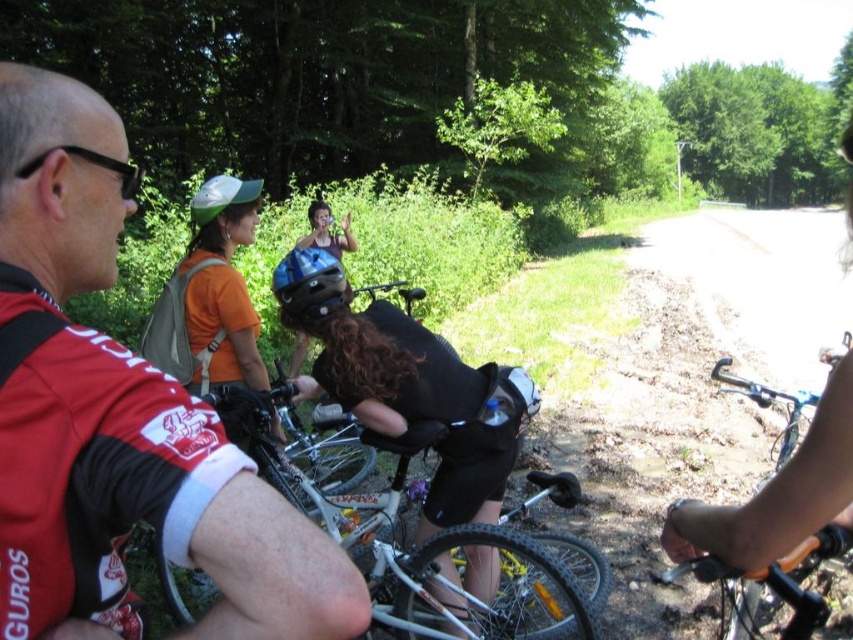
You are a photographer trying to capture a clear shot of the red jersey at center and the matte black helmet at center. Since you want to focus on the smaller object, which one should you aim your camera at?

The red jersey at center has a smaller size compared to matte black helmet at center, so you should aim your camera at the red jersey at center to focus on the smaller object.

You are part of a group of cyclists in a forest area. You notice two points marked in the scene. The first point, labeled as point (51, 618), and the second point labeled as point (374, 413). If you want to take a photo that includes both points clearly, which point should you focus on first to ensure both are in focus?

You should focus on point (51, 618) first since it is closer to the camera than point (374, 413). By focusing on the closer point, the farther point will also be within the depth of field, ensuring both are in focus.

You are a photographer trying to capture a clear shot of the red jersey at center and the matte black helmet at center. Since you want both subjects to be fully visible, which object should you focus on first to ensure it doesn t get cut off by the frame?

The red jersey at center is shorter than the matte black helmet at center, so you should focus on the matte black helmet at center first to ensure it doesn t get cut off by the frame.